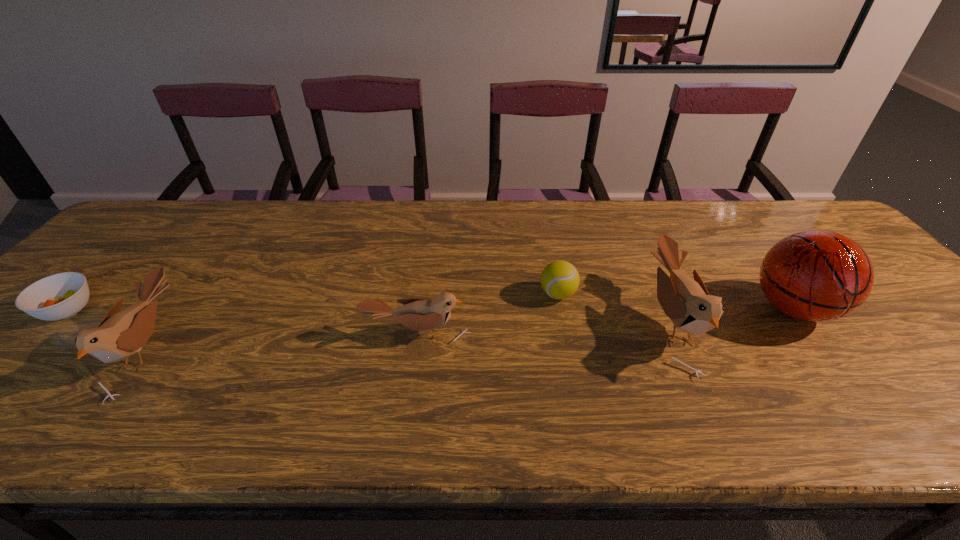
Where is `empty space that is in between the rightmost bird and the basketball`? empty space that is in between the rightmost bird and the basketball is located at coordinates (732, 315).

This screenshot has height=540, width=960. I want to click on unoccupied position between the fifth object from left to right and the second object from left to right, so click(409, 335).

I want to click on empty location between the basketball and the second object from left to right, so click(470, 328).

This screenshot has height=540, width=960. I want to click on vacant space in between the fifth object from right to left and the fourth tallest object, so click(282, 341).

Image resolution: width=960 pixels, height=540 pixels. Find the location of `vacant area that lies between the shortest bird and the tennis ball`. vacant area that lies between the shortest bird and the tennis ball is located at coordinates (488, 314).

Identify the location of free area in between the rightmost bird and the soup bowl. The height and width of the screenshot is (540, 960). (370, 316).

Identify which object is located as the second nearest to the soup bowl. Please provide its 2D coordinates. Your answer should be formatted as a tuple, i.e. [(x, y)], where the tuple contains the x and y coordinates of a point satisfying the conditions above.

[(416, 314)]

Where is `object that stands as the fifth closest to the rightmost object`? The height and width of the screenshot is (540, 960). object that stands as the fifth closest to the rightmost object is located at coordinates (59, 296).

Identify which bird is located as the nearest to the fifth object from left to right. Please provide its 2D coordinates. Your answer should be formatted as a tuple, i.e. [(x, y)], where the tuple contains the x and y coordinates of a point satisfying the conditions above.

[(416, 314)]

Identify the location of bird object that ranks as the second closest to the soup bowl. (416, 314).